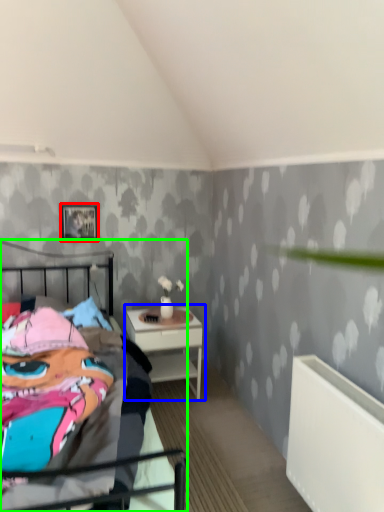
Question: Which is farther away from picture frame (highlighted by a red box)? nightstand (highlighted by a blue box) or bed (highlighted by a green box)?

Choices:
 (A) nightstand
 (B) bed

Answer: (B)